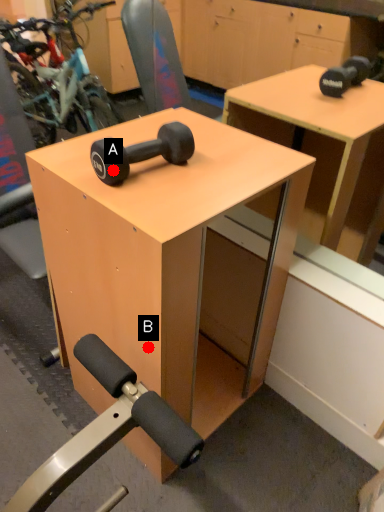
Question: Two points are circled on the image, labeled by A and B beside each circle. Which point appears closest to the camera in this image?

Choices:
 (A) A is closer
 (B) B is closer

Answer: (A)